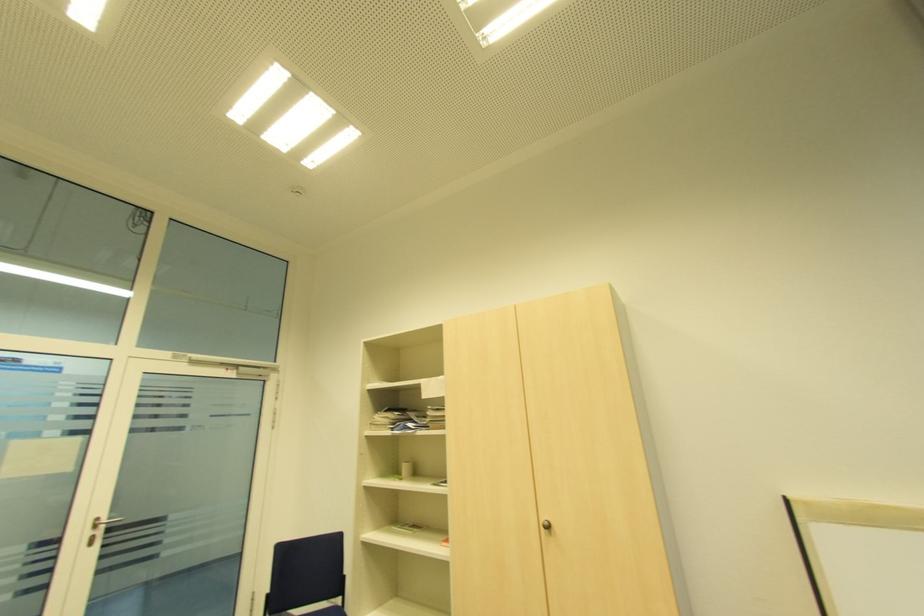
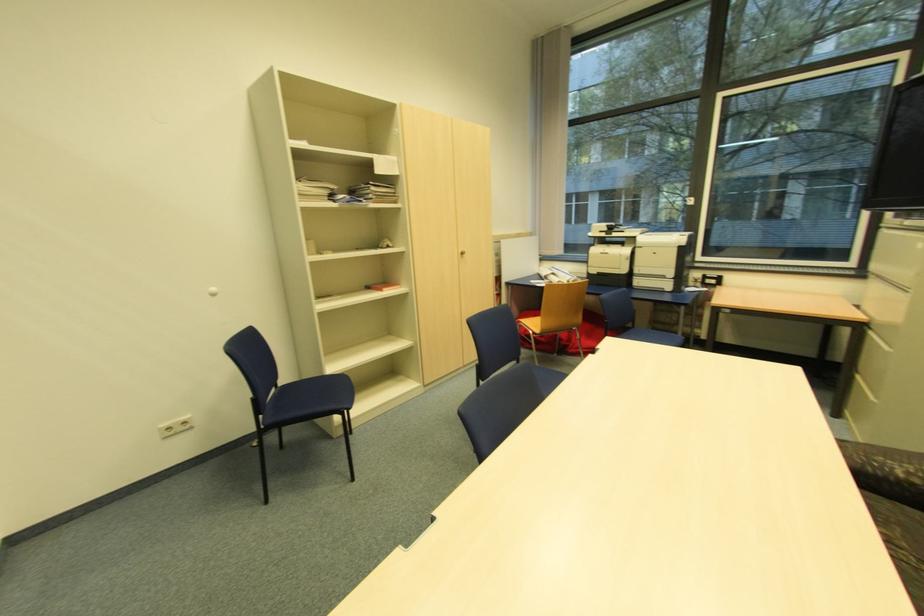
Find the pixel in the second image that matches point (550, 527) in the first image.

(466, 254)